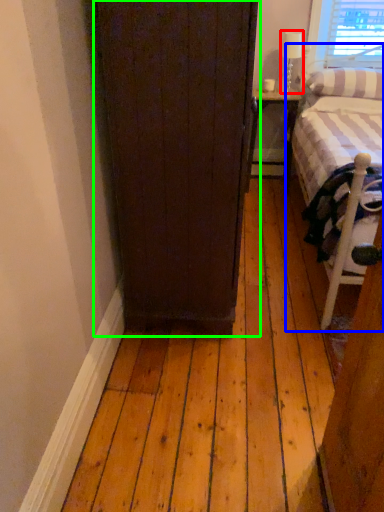
Question: Which object is positioned closest to lamp (highlighted by a red box)? Select from bed (highlighted by a blue box) and door (highlighted by a green box).

Choices:
 (A) bed
 (B) door

Answer: (A)